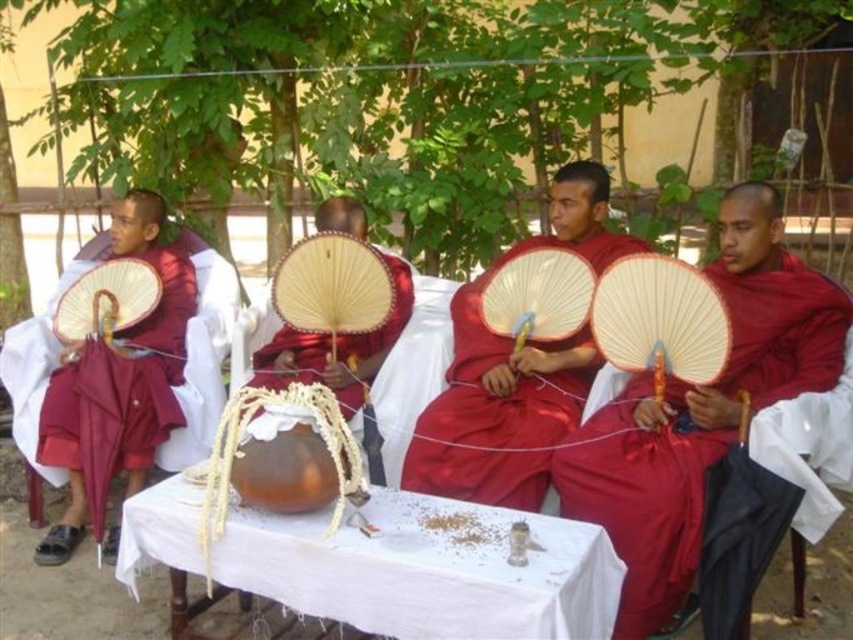
Is matte red robe at right to the left of matte red fan at center from the viewer's perspective?

In fact, matte red robe at right is to the right of matte red fan at center.

Between matte red robe at right and matte red fan at center, which one appears on the left side from the viewer's perspective?

From the viewer's perspective, matte red fan at center appears more on the left side.

Find the location of a particular element. matte red robe at right is located at coordinates (645, 506).

Find the location of a particular element. This screenshot has height=640, width=853. matte red robe at right is located at coordinates (645, 506).

Is white cloth table at center in front of matte red umbrella at left?

Yes, it is.

Does white cloth table at center have a greater height compared to matte red umbrella at left?

No, white cloth table at center is not taller than matte red umbrella at left.

Describe the element at coordinates (427, 570) in the screenshot. I see `white cloth table at center` at that location.

Locate an element on the screen. white cloth table at center is located at coordinates (427, 570).

Measure the distance from matte red robe at right to matte red umbrella at left.

matte red robe at right is 1.90 meters away from matte red umbrella at left.

Does matte red robe at right have a lesser width compared to matte red umbrella at left?

Incorrect, matte red robe at right's width is not less than matte red umbrella at left's.

Describe the element at coordinates (645, 506) in the screenshot. I see `matte red robe at right` at that location.

The width and height of the screenshot is (853, 640). Find the location of `matte red robe at right`. matte red robe at right is located at coordinates click(645, 506).